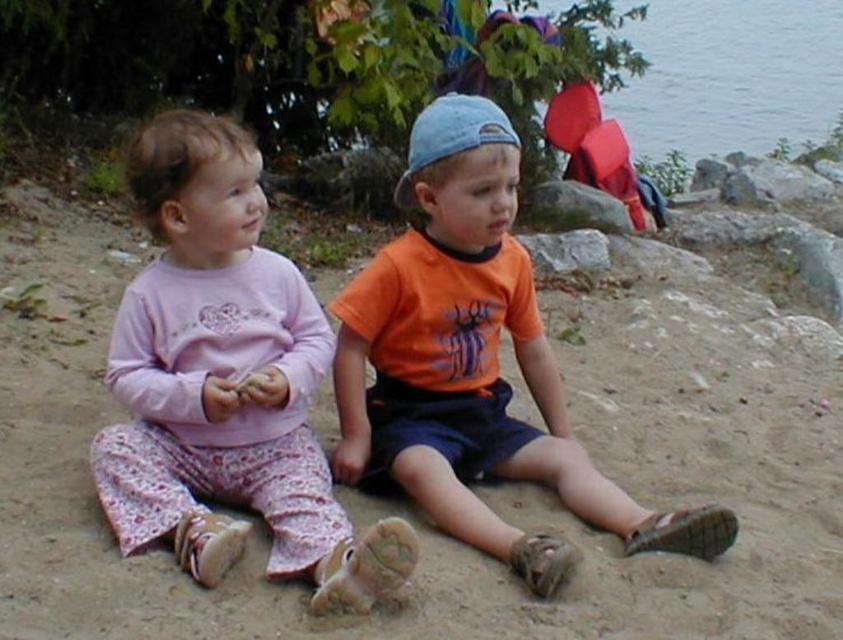
Is pink cotton pajamas at left wider than orange cotton shirt at center?

Incorrect, pink cotton pajamas at left's width does not surpass orange cotton shirt at center's.

Between pink cotton pajamas at left and orange cotton shirt at center, which one has less height?

Standing shorter between the two is pink cotton pajamas at left.

This screenshot has width=843, height=640. Identify the location of pink cotton pajamas at left. (226, 381).

The height and width of the screenshot is (640, 843). Describe the element at coordinates (226, 381) in the screenshot. I see `pink cotton pajamas at left` at that location.

Which is behind, point (366, 600) or point (787, 60)?

The point (787, 60) is behind.

Identify the location of pink cotton pajamas at left. Image resolution: width=843 pixels, height=640 pixels. (226, 381).

This screenshot has height=640, width=843. In order to click on pink cotton pajamas at left in this screenshot , I will do `click(226, 381)`.

Between brown sandy ground at center and orange cotton shirt at center, which one is positioned lower?

Positioned lower is orange cotton shirt at center.

Looking at this image, can you confirm if brown sandy ground at center is smaller than orange cotton shirt at center?

Incorrect, brown sandy ground at center is not smaller in size than orange cotton shirt at center.

You are a GUI agent. You are given a task and a screenshot of the screen. Output one action in this format:
    pyautogui.click(x=<x>, y=<y>)
    Task: Click on the brown sandy ground at center
    This screenshot has width=843, height=640.
    Given the screenshot: What is the action you would take?
    pyautogui.click(x=476, y=488)